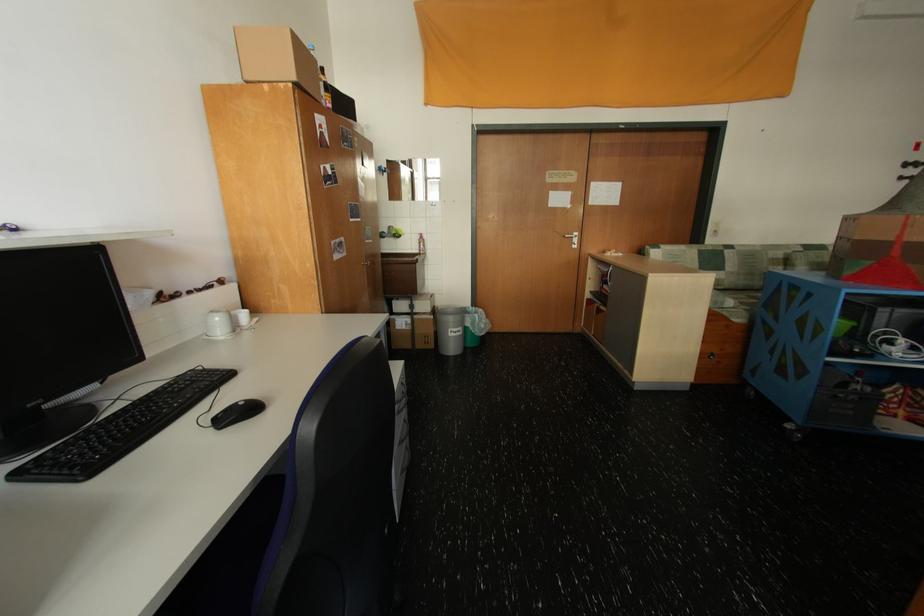
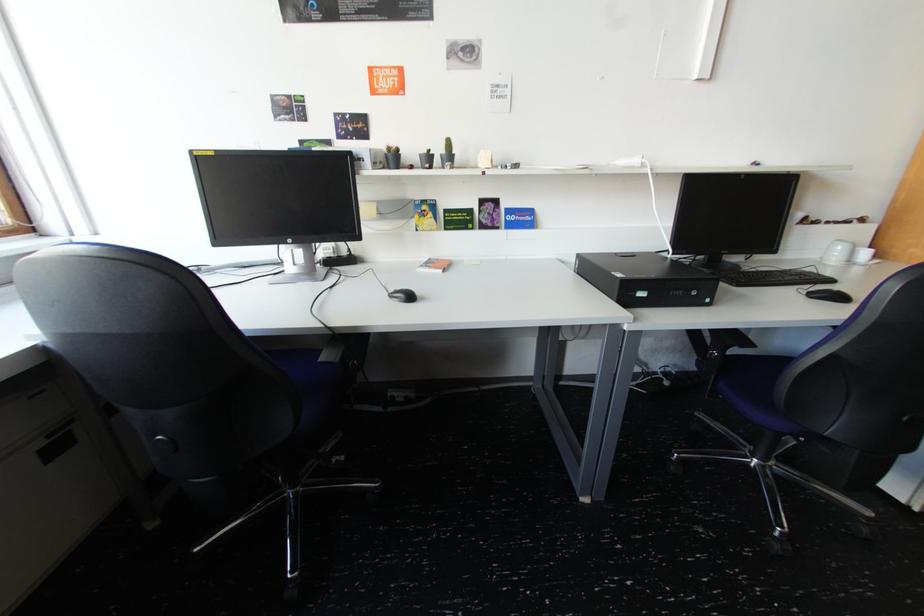
The first image is from the beginning of the video and the second image is from the end. How did the camera likely rotate when shooting the video?

The camera rotated toward left-down.